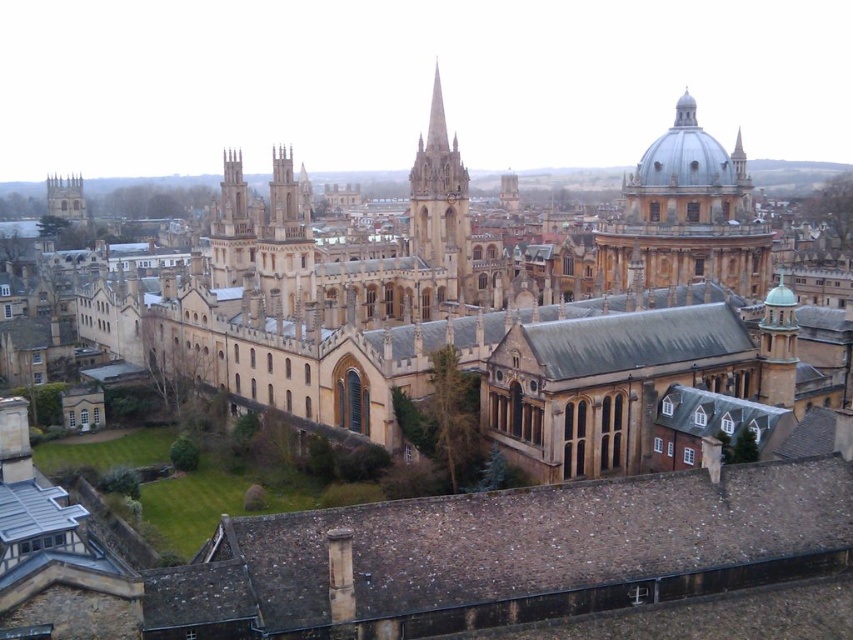
Question: Considering the real-world distances, which object is closest to the smooth stone dome at upper right?

Choices:
 (A) beige stone church at center
 (B) smooth gray dome at upper right
 (C) brown stone roof at lower center
 (D) golden stone spire at center

Answer: (A)

Question: Is brown stone roof at lower center to the left of smooth gray dome at upper right from the viewer's perspective?

Choices:
 (A) yes
 (B) no

Answer: (A)

Question: Can you confirm if golden stone spire at center is positioned to the left of smooth gray dome at upper right?

Choices:
 (A) yes
 (B) no

Answer: (A)

Question: Is golden stone spire at center below smooth gray dome at upper right?

Choices:
 (A) yes
 (B) no

Answer: (B)

Question: Which object appears farthest from the camera in this image?

Choices:
 (A) smooth gray dome at upper right
 (B) golden stone spire at center

Answer: (B)

Question: Which point is closer to the camera?

Choices:
 (A) golden stone spire at center
 (B) smooth gray dome at upper right
 (C) beige stone church at center
 (D) smooth stone dome at upper right

Answer: (C)